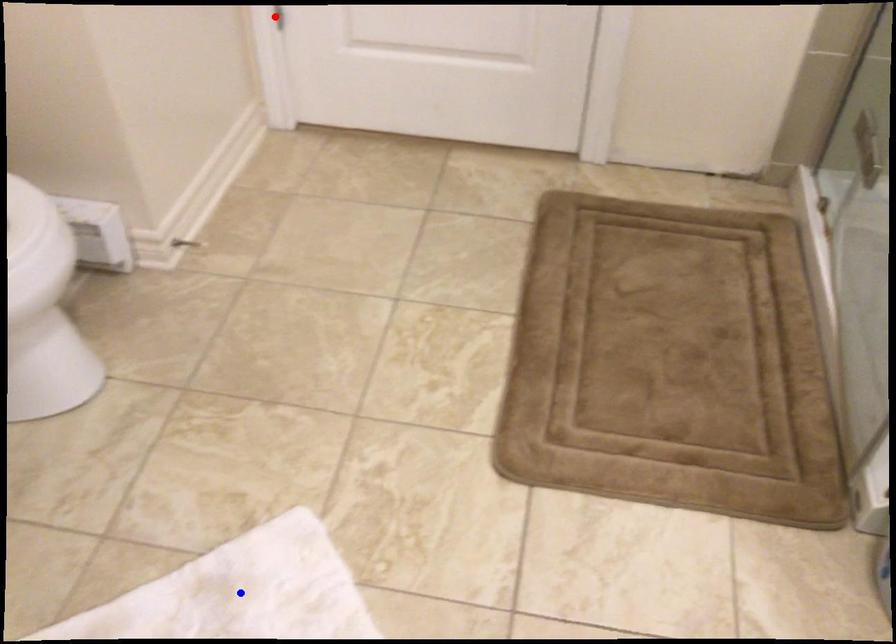
Question: In the image, two points are highlighted. Which point is nearer to the camera? Reply with the corresponding letter.

Choices:
 (A) blue point
 (B) red point

Answer: (A)